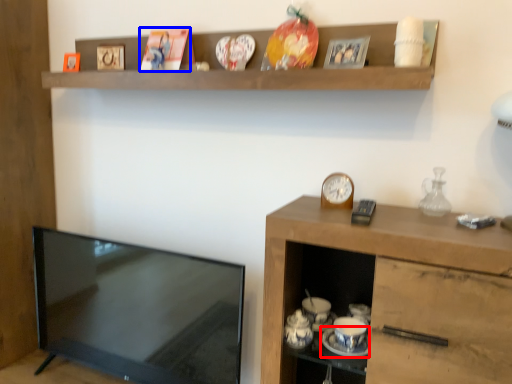
Question: Among these objects, which one is nearest to the camera, saucer (highlighted by a red box) or picture frame (highlighted by a blue box)?

Choices:
 (A) saucer
 (B) picture frame

Answer: (A)